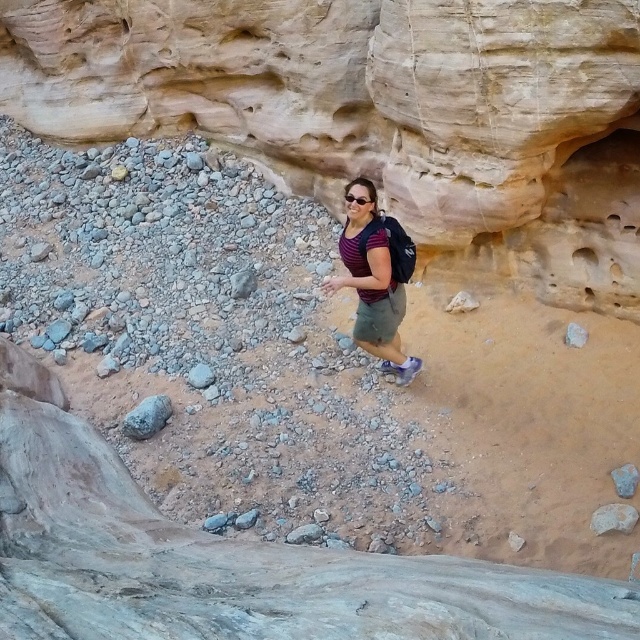
Can you confirm if gray rock at center is positioned to the left of clear plastic goggles at center?

Yes, gray rock at center is to the left of clear plastic goggles at center.

Between point (189, 372) and point (356, 196), which one is positioned in front?

Point (356, 196) is in front.

Identify the location of gray rock at center. (200, 376).

Does smooth sandstone cliff at center have a greater height compared to smooth sandstone rock at center-right?

Yes.

Which is behind, point (122, 84) or point (572, 323)?

The point (122, 84) is more distant.

Is point (547, 116) farther from camera compared to point (568, 332)?

No, (547, 116) is closer to viewer.

Where is `smooth sandstone cliff at center`? This screenshot has width=640, height=640. smooth sandstone cliff at center is located at coordinates (378, 115).

How far apart are smooth beige rock at lower right and smooth sandstone rock at center-right?

smooth beige rock at lower right and smooth sandstone rock at center-right are 4.46 feet apart from each other.

Can you confirm if smooth beige rock at lower right is shorter than smooth sandstone rock at center-right?

Correct, smooth beige rock at lower right is not as tall as smooth sandstone rock at center-right.

The height and width of the screenshot is (640, 640). I want to click on smooth beige rock at lower right, so click(612, 518).